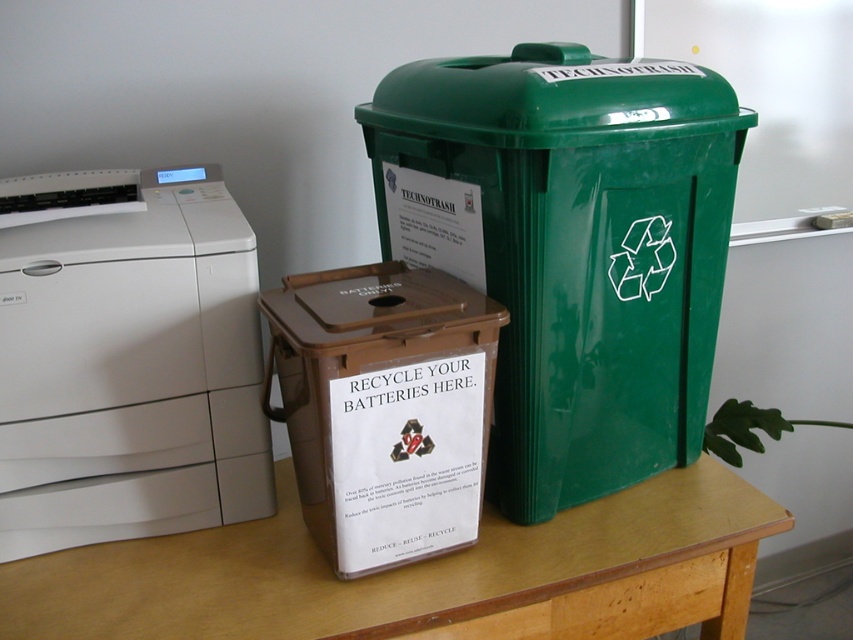
Question: Which point appears closest to the camera in this image?

Choices:
 (A) (386, 264)
 (B) (136, 444)

Answer: (B)

Question: Which point is farther from the camera taking this photo?

Choices:
 (A) (381, 532)
 (B) (57, 483)
 (C) (350, 618)

Answer: (B)

Question: Can you confirm if white plastic printer at left is positioned to the right of brown plastic box at center?

Choices:
 (A) no
 (B) yes

Answer: (A)

Question: Which object appears farthest from the camera in this image?

Choices:
 (A) white plastic printer at left
 (B) light brown wood table at center

Answer: (A)

Question: Does white plastic printer at left lie in front of brown plastic box at center?

Choices:
 (A) yes
 (B) no

Answer: (B)

Question: Does green glossy plastic recycling bin at upper right have a larger size compared to brown plastic box at center?

Choices:
 (A) no
 (B) yes

Answer: (B)